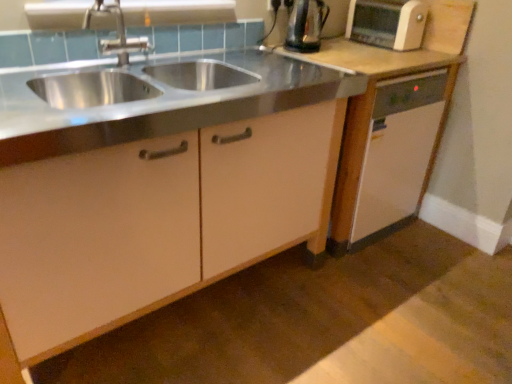
Identify the location of brushed metal faucet at upper left. This screenshot has height=384, width=512. (117, 33).

The height and width of the screenshot is (384, 512). Describe the element at coordinates (305, 25) in the screenshot. I see `metallic silver kettle at upper right` at that location.

In order to face white plastic toaster at upper right, should I rotate leftwards or rightwards?

To face it directly, rotate right by 16.998 degrees.

Where is `white plastic toaster at upper right`? white plastic toaster at upper right is located at coordinates (387, 23).

What do you see at coordinates (157, 221) in the screenshot?
I see `matte white cabinet at center, marked as the second cabinetry in a right-to-left arrangement` at bounding box center [157, 221].

Find the location of a particular element. This screenshot has height=384, width=512. white plastic electric outlet at center is located at coordinates (275, 5).

Does point (341, 225) appear closer or farther from the camera than point (397, 42)?

Point (341, 225) appears to be closer to the viewer than point (397, 42).

Does white matte dishwasher at right, the 1th cabinetry viewed from the right, have a greater width compared to white plastic toaster at upper right?

Yes, white matte dishwasher at right, the 1th cabinetry viewed from the right, is wider than white plastic toaster at upper right.

From a real-world perspective, is white matte dishwasher at right, arranged as the second cabinetry when viewed from the left, above or below white plastic toaster at upper right?

In terms of real-world spatial position, white matte dishwasher at right, arranged as the second cabinetry when viewed from the left, is below white plastic toaster at upper right.

Find the location of a particular element. Image resolution: width=512 pixels, height=384 pixels. cabinetry above the white matte dishwasher at right, the 1th cabinetry viewed from the right (from a real-world perspective) is located at coordinates (157, 221).

Is matte white cabinet at center, which ranks as the 1th cabinetry in left-to-right order, with white matte dishwasher at right, arranged as the second cabinetry when viewed from the left?

Result: They are not placed beside each other.

Considering the relative positions of matte white cabinet at center, which ranks as the 1th cabinetry in left-to-right order, and white matte dishwasher at right, the 1th cabinetry viewed from the right, in the image provided, is matte white cabinet at center, which ranks as the 1th cabinetry in left-to-right order, to the right of white matte dishwasher at right, the 1th cabinetry viewed from the right, from the viewer's perspective?

No.

Between point (145, 292) and point (370, 212), which one is positioned behind?

The point (370, 212) is farther.

I want to click on tap in front of the white plastic electric outlet at center, so click(117, 33).

Considering the relative positions of brushed metal faucet at upper left and white plastic electric outlet at center in the image provided, is brushed metal faucet at upper left to the right of white plastic electric outlet at center from the viewer's perspective?

No, brushed metal faucet at upper left is not to the right of white plastic electric outlet at center.

Which object is wider, brushed metal faucet at upper left or white plastic electric outlet at center?

Wider between the two is brushed metal faucet at upper left.

Is matte white cabinet at center, which ranks as the 1th cabinetry in left-to-right order, not close to white plastic toaster at upper right?

Yes, matte white cabinet at center, which ranks as the 1th cabinetry in left-to-right order, is far from white plastic toaster at upper right.

Which of these two, matte white cabinet at center, marked as the second cabinetry in a right-to-left arrangement, or white plastic toaster at upper right, is smaller?

white plastic toaster at upper right.

Which object is thinner, matte white cabinet at center, marked as the second cabinetry in a right-to-left arrangement, or white plastic toaster at upper right?

With smaller width is white plastic toaster at upper right.

Identify the location of the 1st cabinetry below the white plastic toaster at upper right (from a real-world perspective). (157, 221).

Does white plastic toaster at upper right have a greater width compared to matte white cabinet at center, marked as the second cabinetry in a right-to-left arrangement?

No.

Does point (417, 28) appear closer or farther from the camera than point (102, 193)?

Point (417, 28) is farther from the camera than point (102, 193).

Considering the relative sizes of white plastic toaster at upper right and matte white cabinet at center, marked as the second cabinetry in a right-to-left arrangement, in the image provided, is white plastic toaster at upper right bigger than matte white cabinet at center, marked as the second cabinetry in a right-to-left arrangement,?

No.

Consider the image. From the image's perspective, which one is positioned lower, white plastic toaster at upper right or matte white cabinet at center, which ranks as the 1th cabinetry in left-to-right order?

matte white cabinet at center, which ranks as the 1th cabinetry in left-to-right order, from the image's perspective.

How different are the orientations of matte white cabinet at center, marked as the second cabinetry in a right-to-left arrangement, and brushed metal faucet at upper left in degrees?

The angle between the facing direction of matte white cabinet at center, marked as the second cabinetry in a right-to-left arrangement, and the facing direction of brushed metal faucet at upper left is 40.8 degrees.

From a real-world perspective, is matte white cabinet at center, which ranks as the 1th cabinetry in left-to-right order, above or below brushed metal faucet at upper left?

matte white cabinet at center, which ranks as the 1th cabinetry in left-to-right order, is below brushed metal faucet at upper left.

Considering the sizes of matte white cabinet at center, which ranks as the 1th cabinetry in left-to-right order, and brushed metal faucet at upper left in the image, is matte white cabinet at center, which ranks as the 1th cabinetry in left-to-right order, bigger or smaller than brushed metal faucet at upper left?

Considering their sizes, matte white cabinet at center, which ranks as the 1th cabinetry in left-to-right order, takes up more space than brushed metal faucet at upper left.

From the image's perspective, would you say matte white cabinet at center, marked as the second cabinetry in a right-to-left arrangement, is shown under brushed metal faucet at upper left?

Yes, from the image's perspective, matte white cabinet at center, marked as the second cabinetry in a right-to-left arrangement, is below brushed metal faucet at upper left.

From the image's perspective, is white plastic electric outlet at center positioned above or below brushed metal faucet at upper left?

white plastic electric outlet at center is above brushed metal faucet at upper left.

Is white plastic electric outlet at center inside or outside of brushed metal faucet at upper left?

white plastic electric outlet at center is not inside brushed metal faucet at upper left, it's outside.

Considering the sizes of white plastic electric outlet at center and brushed metal faucet at upper left in the image, is white plastic electric outlet at center taller or shorter than brushed metal faucet at upper left?

Considering their sizes, white plastic electric outlet at center has less height than brushed metal faucet at upper left.

From a real-world perspective, who is located higher, white plastic electric outlet at center or brushed metal faucet at upper left?

In real-world perspective, white plastic electric outlet at center is above.

Locate an element on the screen. Image resolution: width=512 pixels, height=384 pixels. home appliance that appears above the white matte dishwasher at right, the 1th cabinetry viewed from the right (from the image's perspective) is located at coordinates (387, 23).

Image resolution: width=512 pixels, height=384 pixels. I want to click on cabinetry on the left side of white matte dishwasher at right, the 1th cabinetry viewed from the right, so click(x=157, y=221).

From the image, which object appears to be nearer to metallic silver kettle at upper right, white matte dishwasher at right, arranged as the second cabinetry when viewed from the left, or white plastic electric outlet at center?

Based on the image, white plastic electric outlet at center appears to be nearer to metallic silver kettle at upper right.

From the image, which object appears to be farther from brushed metal faucet at upper left, white plastic electric outlet at center or metallic silver kettle at upper right?

Based on the image, white plastic electric outlet at center appears to be further to brushed metal faucet at upper left.

Based on their spatial positions, is metallic silver kettle at upper right or white matte dishwasher at right, arranged as the second cabinetry when viewed from the left, closer to brushed metal faucet at upper left?

metallic silver kettle at upper right is positioned closer to the anchor brushed metal faucet at upper left.

From the image, which object appears to be nearer to white plastic toaster at upper right, white plastic electric outlet at center or matte white cabinet at center, marked as the second cabinetry in a right-to-left arrangement?

Based on the image, white plastic electric outlet at center appears to be nearer to white plastic toaster at upper right.

Estimate the real-world distances between objects in this image. Which object is closer to white plastic electric outlet at center, metallic silver kettle at upper right or brushed metal faucet at upper left?

Among the two, metallic silver kettle at upper right is located nearer to white plastic electric outlet at center.

Looking at the image, which one is located further to white plastic electric outlet at center, white matte dishwasher at right, arranged as the second cabinetry when viewed from the left, or metallic silver kettle at upper right?

white matte dishwasher at right, arranged as the second cabinetry when viewed from the left, is further to white plastic electric outlet at center.

Which object lies further to the anchor point white matte dishwasher at right, the 1th cabinetry viewed from the right, brushed metal faucet at upper left or white plastic toaster at upper right?

brushed metal faucet at upper left is further to white matte dishwasher at right, the 1th cabinetry viewed from the right.

When comparing their distances from metallic silver kettle at upper right, does brushed metal faucet at upper left or white plastic toaster at upper right seem closer?

Based on the image, white plastic toaster at upper right appears to be nearer to metallic silver kettle at upper right.

At what (x,y) coordinates should I click in order to perform the action: click on home appliance between white plastic electric outlet at center and white matte dishwasher at right, arranged as the second cabinetry when viewed from the left, vertically. Please return your answer as a coordinate pair (x, y). The width and height of the screenshot is (512, 384). Looking at the image, I should click on (387, 23).

Image resolution: width=512 pixels, height=384 pixels. In order to click on kitchen appliance between brushed metal faucet at upper left and white plastic electric outlet at center along the z-axis in this screenshot , I will do `click(305, 25)`.

Where is `kitchen appliance between white plastic electric outlet at center and white matte dishwasher at right, the 1th cabinetry viewed from the right, in the up-down direction`? The image size is (512, 384). kitchen appliance between white plastic electric outlet at center and white matte dishwasher at right, the 1th cabinetry viewed from the right, in the up-down direction is located at coordinates (305, 25).

Image resolution: width=512 pixels, height=384 pixels. In order to click on kitchen appliance that lies between white plastic toaster at upper right and white matte dishwasher at right, the 1th cabinetry viewed from the right, from top to bottom in this screenshot , I will do `click(305, 25)`.